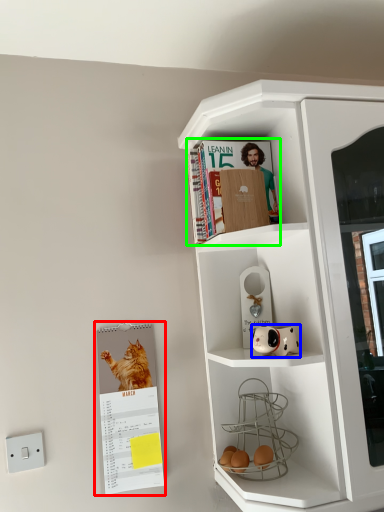
Question: Considering the real-world distances, which object is closest to paperback book (highlighted by a red box)? toy (highlighted by a blue box) or magazine (highlighted by a green box).

Choices:
 (A) toy
 (B) magazine

Answer: (A)